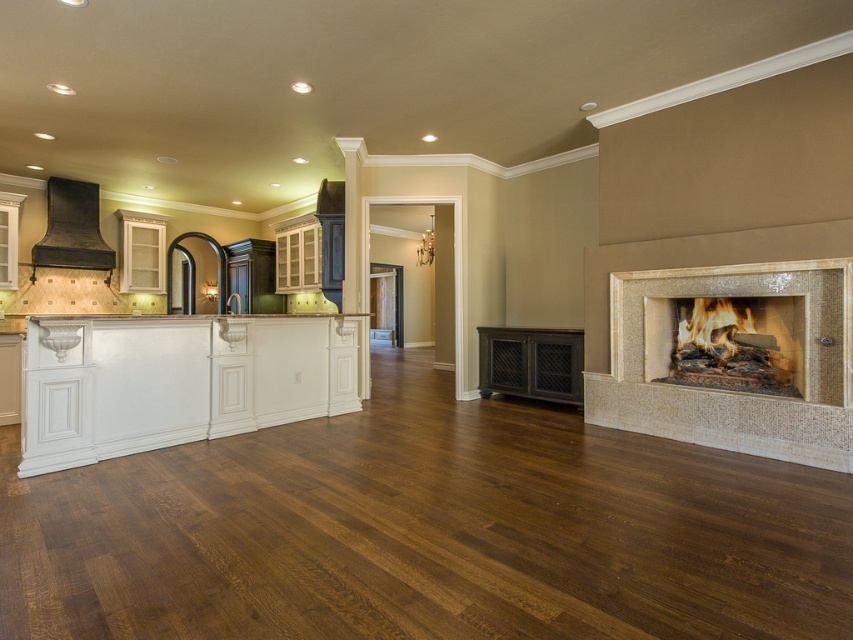
Question: Which object is closer to the camera taking this photo?

Choices:
 (A) matte stone fireplace at right
 (B) matte black range hood at upper left
 (C) beige mosaic tile fireplace at right

Answer: (C)

Question: Which of the following is the farthest from the observer?

Choices:
 (A) (73, 244)
 (B) (751, 372)

Answer: (A)

Question: Does matte stone fireplace at right have a lesser width compared to matte black range hood at upper left?

Choices:
 (A) yes
 (B) no

Answer: (B)

Question: Can you confirm if beige mosaic tile fireplace at right is wider than matte stone fireplace at right?

Choices:
 (A) no
 (B) yes

Answer: (B)

Question: Which object is farther from the camera taking this photo?

Choices:
 (A) matte black range hood at upper left
 (B) matte stone fireplace at right
 (C) beige mosaic tile fireplace at right

Answer: (A)

Question: Can you confirm if beige mosaic tile fireplace at right is positioned below matte stone fireplace at right?

Choices:
 (A) no
 (B) yes

Answer: (B)